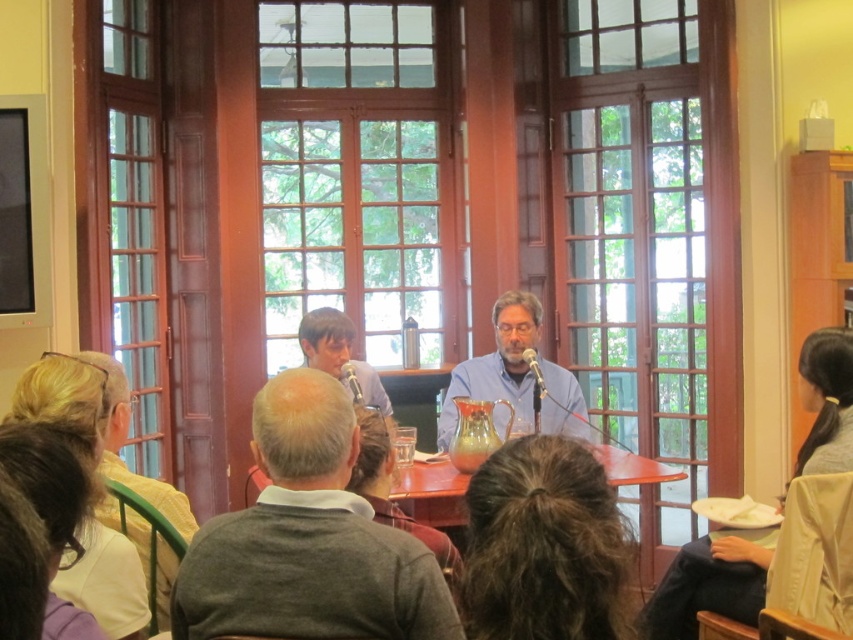
Consider the image. You are standing in the room and want to reach the point marked as point (548, 408). If your walking speed is 1.2 meters per second, how many seconds will it take you to reach that point?

The distance between you and point (548, 408) is 4.25 meters. At a speed of 1.2 meters per second, it will take approximately 3.54 seconds to reach the point.

You are standing at the entrance of the room and want to locate the gray sweater at center. Based on the coordinates provided, can you determine its position relative to the center of the room?

The gray sweater at center is located at coordinates point 0.842 on the x axis and 0.362 on the y axis, which places it slightly to the right and lower than the exact center of the room.